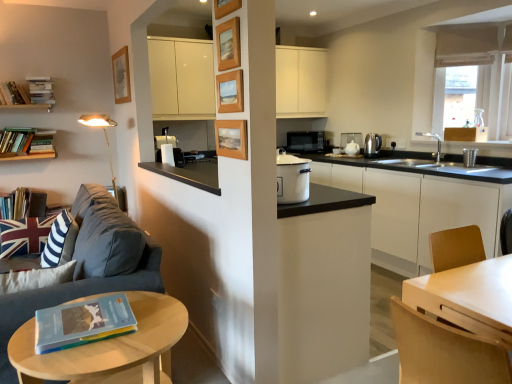
Identify the location of free space above white ceramic teapot at center-right, marked as the 4th appliance in a front-to-back arrangement (from a real-world perspective). This screenshot has height=384, width=512. (346, 136).